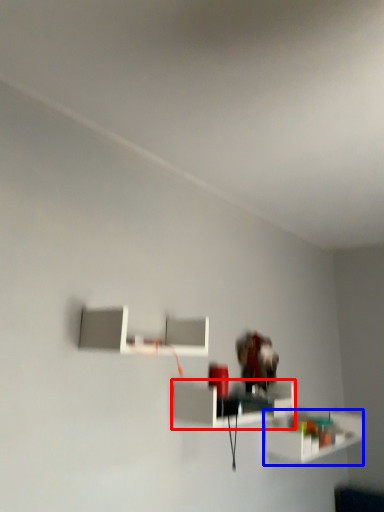
Question: Which of the following is the closest to the observer, shelf (highlighted by a red box) or shelf (highlighted by a blue box)?

Choices:
 (A) shelf
 (B) shelf

Answer: (A)